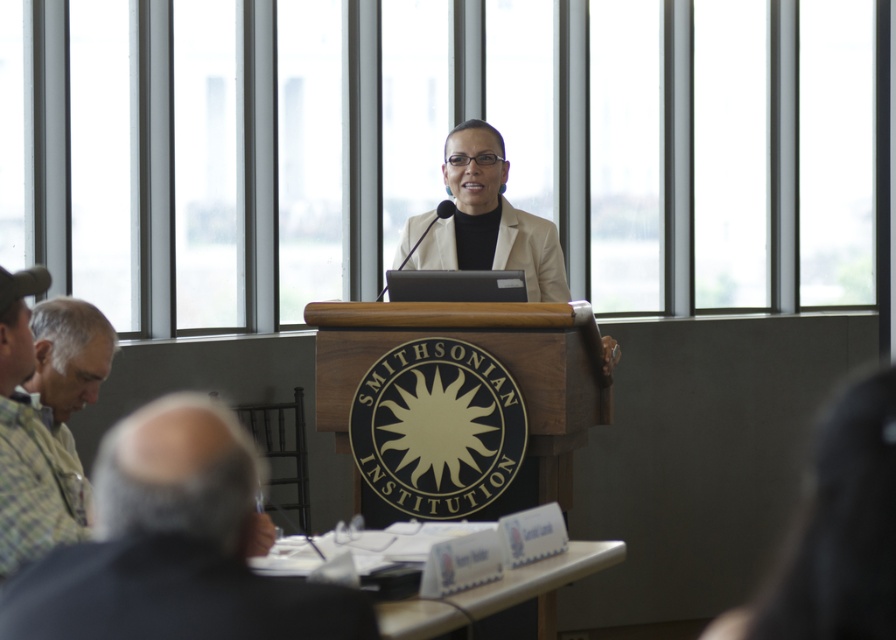
You are attending a virtual event and need to focus on the speaker. The camera is currently centered on the smooth black hair at center. Is the speaker visible in this view?

The smooth black hair at center is located at point (836, 531), which means the camera is focused on the speaker, so yes, the speaker is visible.

You are a photographer positioned at the back of the room. You want to take a photo of the speaker, focusing on the gray fabric shirt at lower left and smooth black hair at center. Given that your camera has a maximum zoom range of 5 meters, can you clearly capture both objects in focus without moving closer?

The gray fabric shirt at lower left is 6.18 meters from smooth black hair at center. Since the maximum zoom range of the camera is 5 meters, the distance between them exceeds the camera capability. Therefore, you cannot clearly capture both objects in focus without moving closer.

You are an attendee at the event and want to describe the speaker to a friend who hasn t arrived yet. Which item is positioned higher on the speaker s body the gray fabric shirt at lower left or the smooth black hair at center?

The gray fabric shirt at lower left is positioned higher on the speaker s body than the smooth black hair at center.